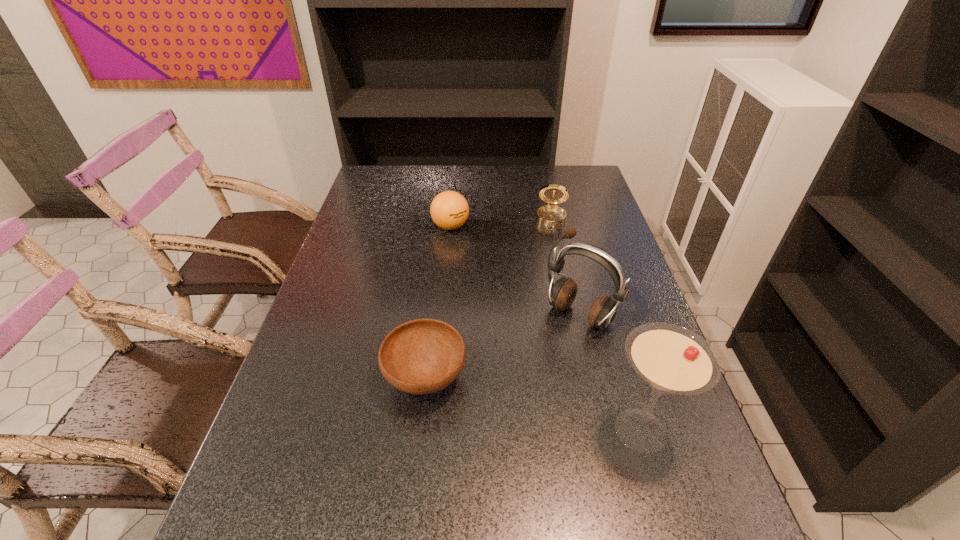
In order to click on vacant space that is in between the shortest object and the compass in this screenshot , I will do tap(489, 299).

Image resolution: width=960 pixels, height=540 pixels. Identify the location of free spot between the third nearest object and the martini. (610, 373).

Where is `blank region between the martini and the bowl`? The image size is (960, 540). blank region between the martini and the bowl is located at coordinates (533, 404).

At what (x,y) coordinates should I click in order to perform the action: click on free space between the third farthest object and the martini. Please return your answer as a coordinate pair (x, y). This screenshot has height=540, width=960. Looking at the image, I should click on (610, 373).

Find the location of `empty space that is in between the compass and the bowl`. empty space that is in between the compass and the bowl is located at coordinates click(489, 299).

At what (x,y) coordinates should I click in order to perform the action: click on blank region between the earphone and the ping-pong ball. Please return your answer as a coordinate pair (x, y). The image size is (960, 540). Looking at the image, I should click on (516, 271).

At what (x,y) coordinates should I click in order to perform the action: click on empty space between the compass and the ping-pong ball. Please return your answer as a coordinate pair (x, y). This screenshot has height=540, width=960. Looking at the image, I should click on (501, 223).

Select which object appears as the second closest to the shortest object. Please provide its 2D coordinates. Your answer should be formatted as a tuple, i.e. [(x, y)], where the tuple contains the x and y coordinates of a point satisfying the conditions above.

[(671, 359)]

Find the location of a particular element. This screenshot has height=540, width=960. object that is the closest to the shortest object is located at coordinates (561, 294).

Where is `vacant area that satisfies the following two spatial constraints: 1. on the back side of the compass; 2. on the left side of the ping-pong ball`? vacant area that satisfies the following two spatial constraints: 1. on the back side of the compass; 2. on the left side of the ping-pong ball is located at coordinates (451, 220).